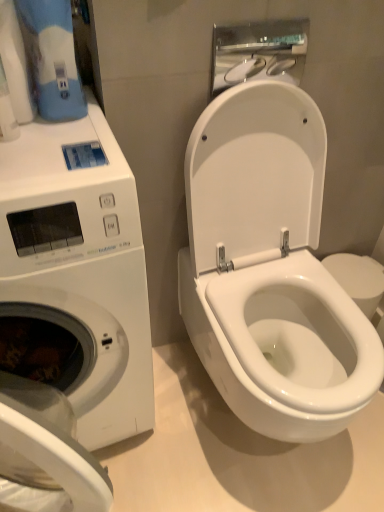
Where is `vacant space in front of white glossy toilet paper at upper left`? The height and width of the screenshot is (512, 384). vacant space in front of white glossy toilet paper at upper left is located at coordinates (33, 155).